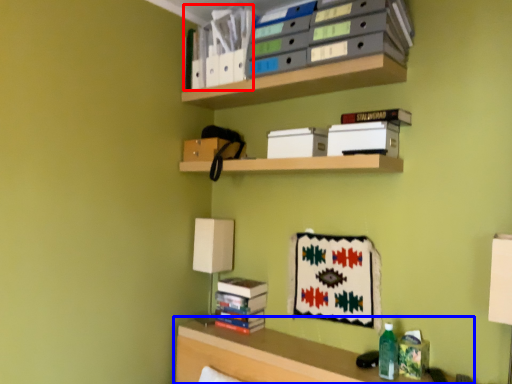
Question: Among these objects, which one is nearest to the camera, book (highlighted by a red box) or shelf (highlighted by a blue box)?

Choices:
 (A) book
 (B) shelf

Answer: (B)